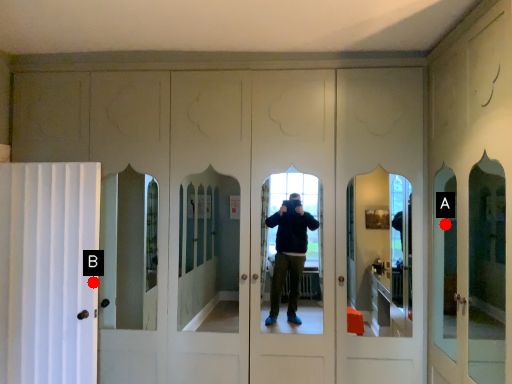
Question: Two points are circled on the image, labeled by A and B beside each circle. Which point is closer to the camera?

Choices:
 (A) A is closer
 (B) B is closer

Answer: (A)